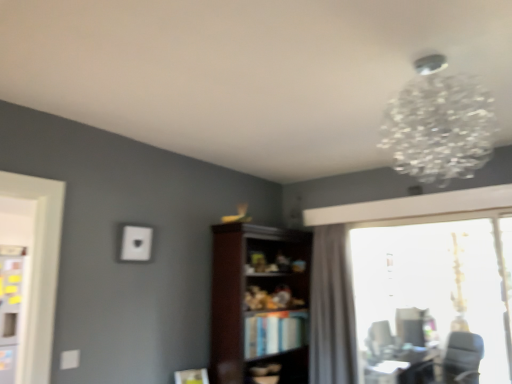
Question: Would you say transparent glass window at right is outside matte black swivel chair at lower right, the second swivel chair in the right-to-left sequence?

Choices:
 (A) no
 (B) yes

Answer: (B)

Question: Is transparent glass window at right placed right next to matte black swivel chair at lower right, acting as the second swivel chair starting from the front?

Choices:
 (A) no
 (B) yes

Answer: (A)

Question: Would you say transparent glass window at right is a long distance from matte black swivel chair at lower right, acting as the second swivel chair starting from the front?

Choices:
 (A) no
 (B) yes

Answer: (B)

Question: Considering the relative positions of transparent glass window at right and matte black swivel chair at lower right, the first swivel chair from the left, in the image provided, is transparent glass window at right to the right of matte black swivel chair at lower right, the first swivel chair from the left, from the viewer's perspective?

Choices:
 (A) yes
 (B) no

Answer: (B)

Question: Does transparent glass window at right have a lesser width compared to matte black swivel chair at lower right, acting as the second swivel chair starting from the front?

Choices:
 (A) no
 (B) yes

Answer: (A)

Question: From the image's perspective, is transparent glass window at right under matte black swivel chair at lower right, the second swivel chair in the right-to-left sequence?

Choices:
 (A) yes
 (B) no

Answer: (B)

Question: From the image's perspective, is matte black swivel chair at lower right, the first swivel chair from the left, beneath transparent glass window at right?

Choices:
 (A) no
 (B) yes

Answer: (B)

Question: Does matte black swivel chair at lower right, the second swivel chair in the right-to-left sequence, appear on the right side of transparent glass window at right?

Choices:
 (A) no
 (B) yes

Answer: (B)

Question: Is matte black swivel chair at lower right, the first swivel chair from the left, thinner than transparent glass window at right?

Choices:
 (A) no
 (B) yes

Answer: (B)

Question: Does matte black swivel chair at lower right, which ranks as the 1th swivel chair in back-to-front order, touch transparent glass window at right?

Choices:
 (A) yes
 (B) no

Answer: (B)

Question: From the image's perspective, is matte black swivel chair at lower right, acting as the second swivel chair starting from the front, above transparent glass window at right?

Choices:
 (A) yes
 (B) no

Answer: (B)

Question: Does matte black swivel chair at lower right, acting as the second swivel chair starting from the front, have a greater width compared to transparent glass window at right?

Choices:
 (A) no
 (B) yes

Answer: (A)

Question: From the image's perspective, is black leather swivel chair at lower right, which is the 2th swivel chair from back to front, located beneath dark wood bookshelf at center?

Choices:
 (A) yes
 (B) no

Answer: (A)